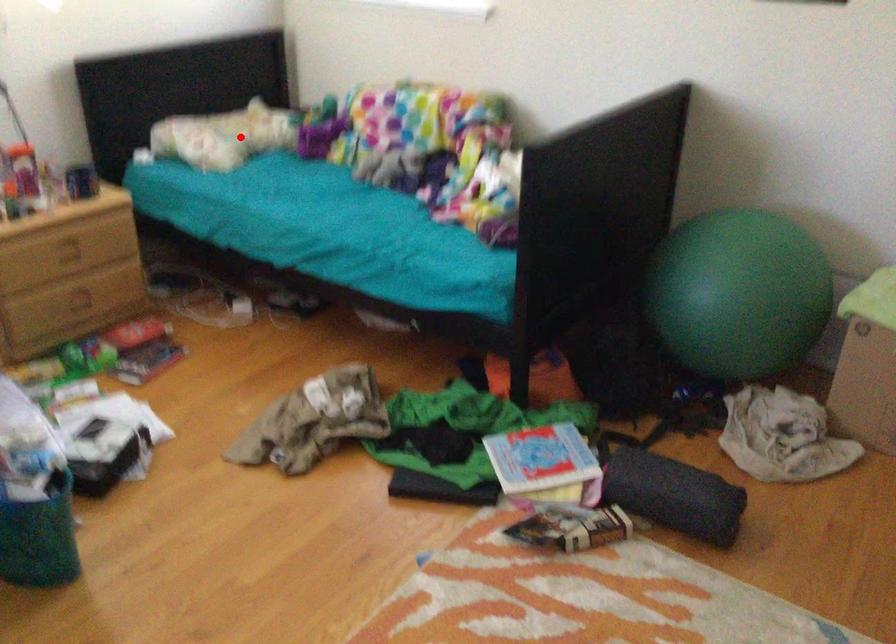
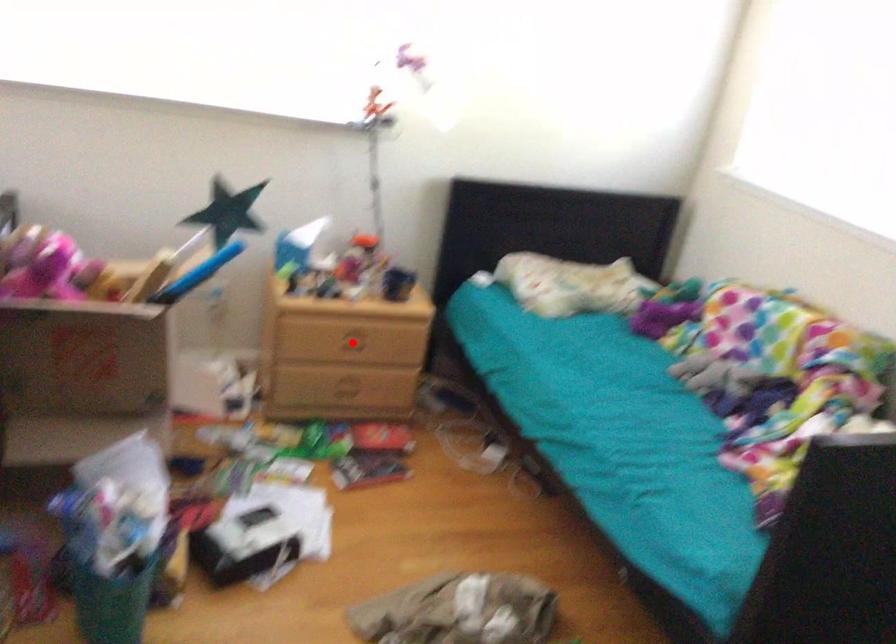
I am providing you with two images of the same scene from different viewpoints. A red point is marked on the first image and another point is marked on the second image. Do the highlighted points in image1 and image2 indicate the same real-world spot?

No